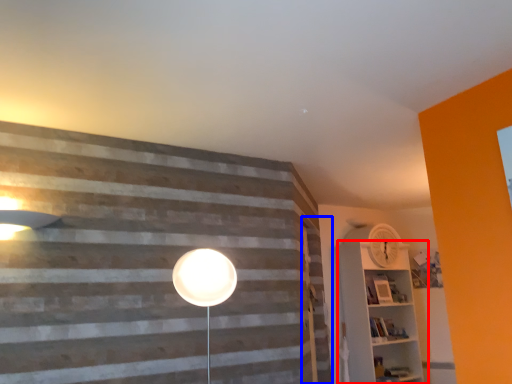
Question: Which of the following is the farthest to the observer, shelf (highlighted by a red box) or barn door (highlighted by a blue box)?

Choices:
 (A) shelf
 (B) barn door

Answer: (A)